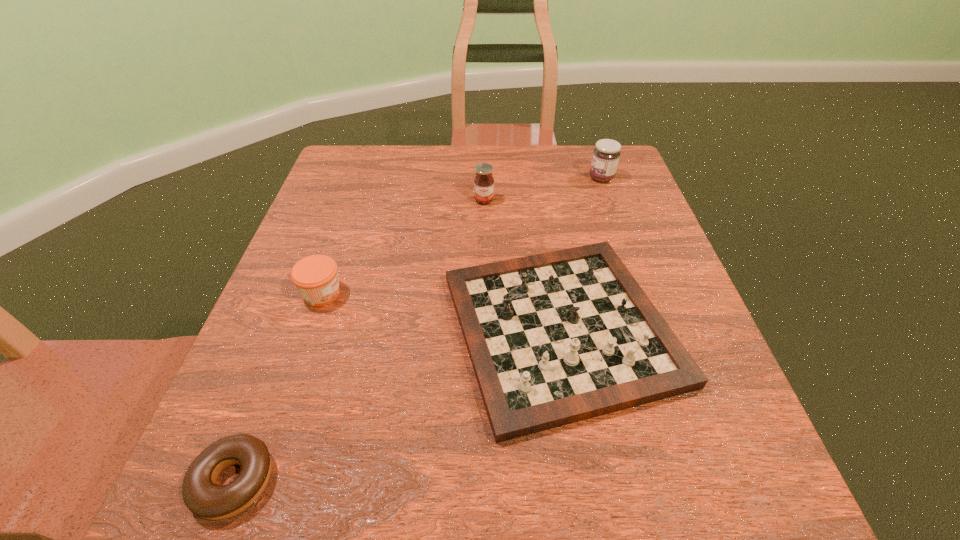
Identify the location of object located in the near left corner section of the desktop. This screenshot has width=960, height=540. [x=201, y=495].

Locate an element on the screen. The width and height of the screenshot is (960, 540). object that is at the far right corner is located at coordinates (606, 154).

This screenshot has height=540, width=960. In order to click on vacant area at the far edge in this screenshot , I will do `click(476, 161)`.

The height and width of the screenshot is (540, 960). I want to click on free space at the near edge of the desktop, so click(x=571, y=491).

Locate an element on the screen. The width and height of the screenshot is (960, 540). free region at the left edge is located at coordinates (298, 402).

I want to click on free region at the right edge of the desktop, so click(599, 238).

In the image, there is a desktop. At what (x,y) coordinates should I click in order to perform the action: click on free space at the far left corner. Please return your answer as a coordinate pair (x, y). The image size is (960, 540). Looking at the image, I should click on (346, 145).

At what (x,y) coordinates should I click in order to perform the action: click on vacant space at the far right corner. Please return your answer as a coordinate pair (x, y). This screenshot has width=960, height=540. Looking at the image, I should click on (583, 150).

This screenshot has height=540, width=960. What are the coordinates of `vacant area that lies between the shortest object and the chessboard` in the screenshot? It's located at (397, 404).

Find the location of a particular element. The width and height of the screenshot is (960, 540). blank region between the nearest jam and the doughnut is located at coordinates (278, 387).